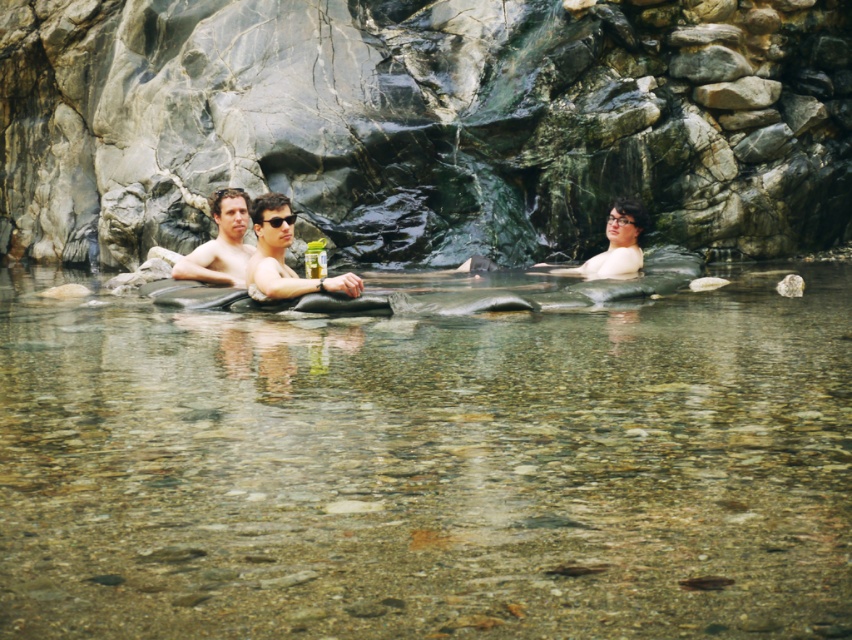
You are a photographer standing at the edge of the clear stone river at center, and you want to take a photo of the smooth skin couple at center. Your camera has a maximum zoom range of 5 meters. Can you capture the couple clearly without moving closer?

The distance between the clear stone river at center and the smooth skin couple at center is 5.75 meters. Since the camera can only zoom up to 5 meters, you cannot capture the couple clearly without moving closer.